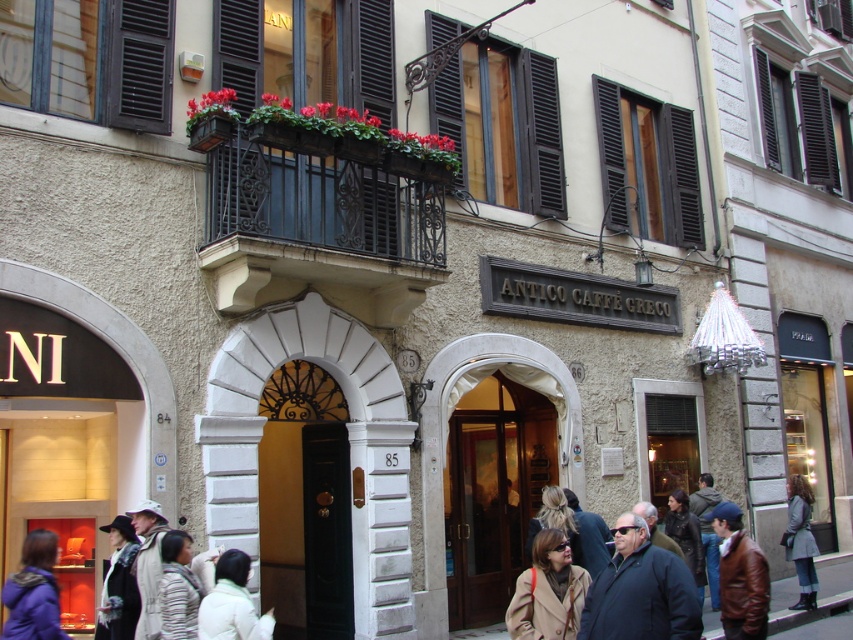
You are standing in front of the Antico Caff? Greco building and need to enter through the wooden door at center. However, there is a person wearing a white puffy coat at lower center blocking your path. Can you walk around them to reach the door without going around the building?

The wooden door at center is positioned on the right side of the white puffy coat at lower center, so you can walk around to the right side of the white puffy coat at lower center to reach the wooden door at center without going around the building.